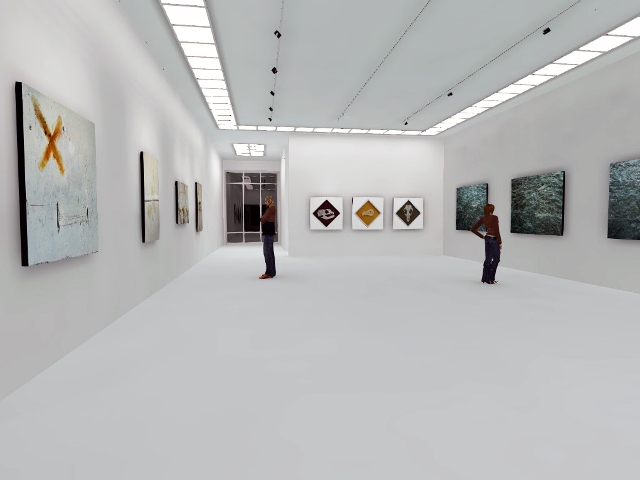
Where is `white walls`? white walls is located at coordinates (111, 75), (345, 158), (550, 153).